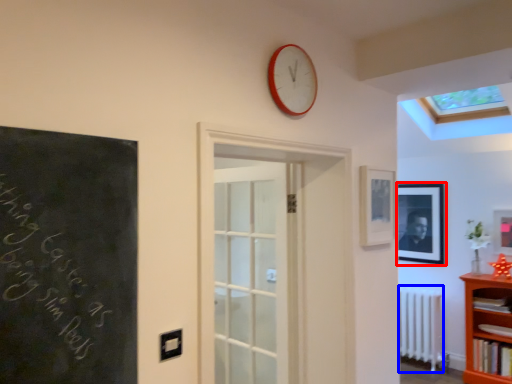
Question: Among these objects, which one is nearest to the camera, picture frame (highlighted by a red box) or radiator (highlighted by a blue box)?

Choices:
 (A) picture frame
 (B) radiator

Answer: (B)